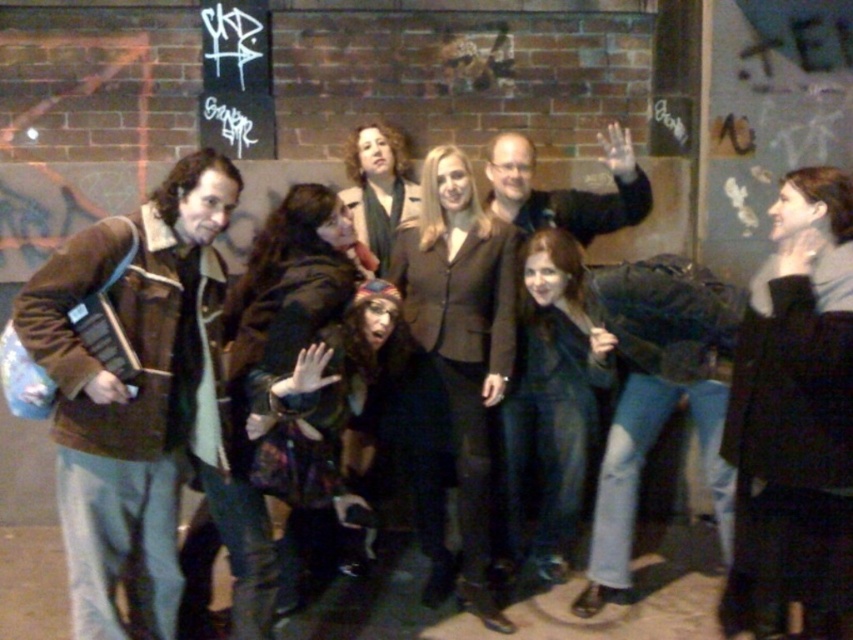
Question: Does plaid fabric jacket at center have a lesser width compared to matte brown jacket at center?

Choices:
 (A) no
 (B) yes

Answer: (B)

Question: Which object appears farthest from the camera in this image?

Choices:
 (A) black fur coat at upper right
 (B) matte brown blazer at center

Answer: (B)

Question: Does plaid fabric jacket at center lie in front of matte brown jacket at center?

Choices:
 (A) yes
 (B) no

Answer: (A)

Question: Which object is closer to the camera taking this photo?

Choices:
 (A) matte brown jacket at center
 (B) brown leather jacket at left
 (C) plaid fabric jacket at center
 (D) matte black jacket at center

Answer: (B)

Question: Can you confirm if plaid fabric jacket at center is wider than matte brown coat at center?

Choices:
 (A) yes
 (B) no

Answer: (A)

Question: Among these points, which one is farthest from the camera?

Choices:
 (A) (386, 177)
 (B) (296, 248)
 (C) (519, 330)
 (D) (633, 212)

Answer: (A)